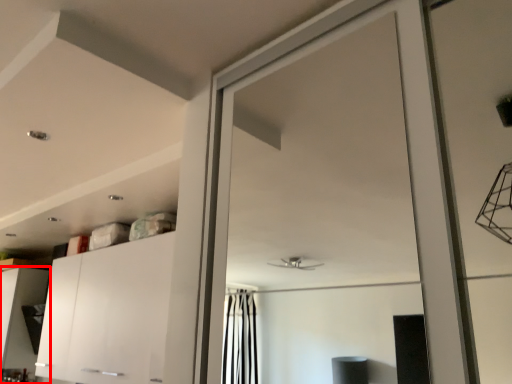
Question: Observing the image, what is the correct spatial positioning of cabinetry (annotated by the red box) in reference to cabinetry?

Choices:
 (A) right
 (B) left

Answer: (B)